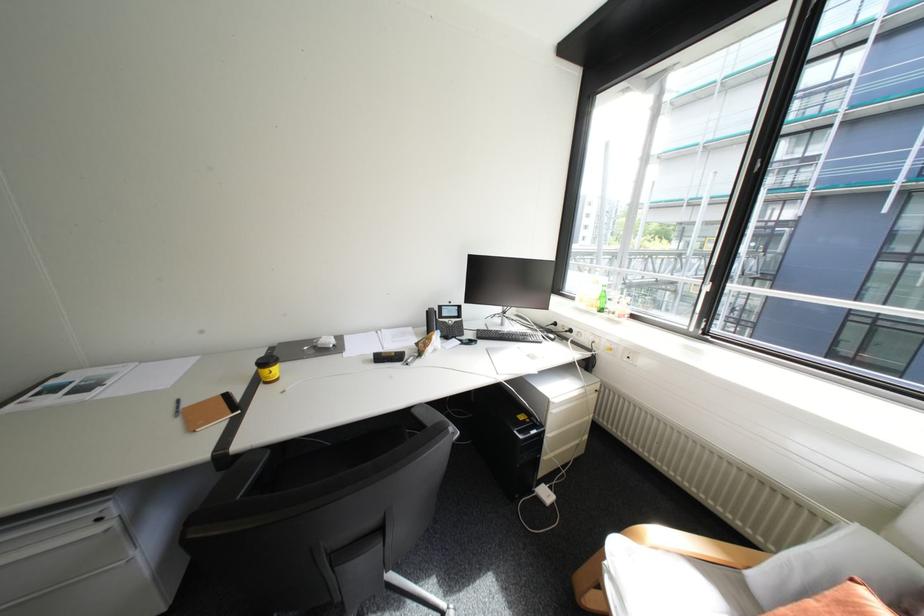
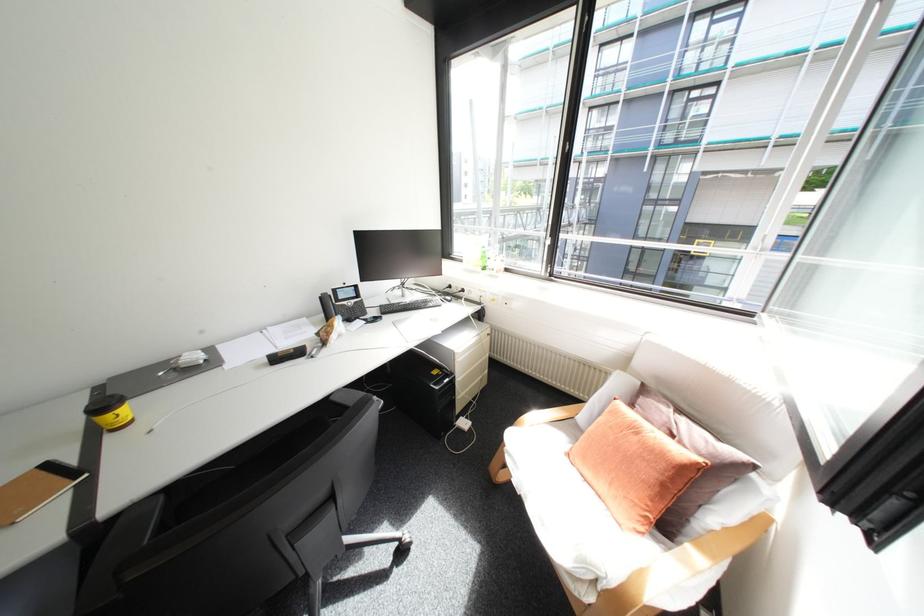
Locate, in the second image, the point that corresponds to point 500,331 in the first image.

(403, 304)